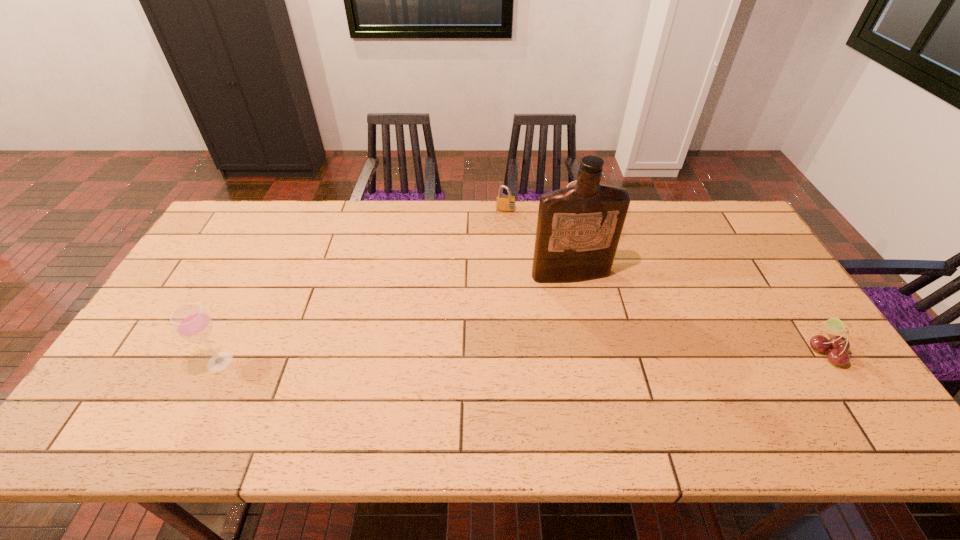
Find the location of a particular element. Image resolution: width=960 pixels, height=540 pixels. vacant space located on the leaves of the cherry is located at coordinates (735, 351).

This screenshot has width=960, height=540. I want to click on vacant space situated 0.390m on the side with the combination dials of the padlock, so click(x=501, y=297).

Identify the location of vacant space located on the side with the combination dials of the padlock. Image resolution: width=960 pixels, height=540 pixels. (505, 226).

I want to click on vacant space located on the side with the combination dials of the padlock, so click(x=504, y=245).

Identify the location of vacant position located 0.110m on the label side of the liquor. This screenshot has height=540, width=960. (588, 311).

Identify the location of vacant space located 0.320m on the label side of the liquor. (612, 375).

Locate an element on the screen. Image resolution: width=960 pixels, height=540 pixels. free spot located on the label side of the liquor is located at coordinates (594, 328).

At what (x,y) coordinates should I click in order to perform the action: click on vacant space situated 0.310m on the side of the mug with the handle. Please return your answer as a coordinate pair (x, y). This screenshot has width=960, height=540. Looking at the image, I should click on (595, 299).

You are a GUI agent. You are given a task and a screenshot of the screen. Output one action in this format:
    pyautogui.click(x=<x>, y=<y>)
    Task: Click on the vacant area situated on the side of the mug with the handle
    This screenshot has width=960, height=540.
    Given the screenshot: What is the action you would take?
    pyautogui.click(x=590, y=270)

The width and height of the screenshot is (960, 540). Identify the location of vacant space located 0.130m on the side of the mug with the handle. (588, 257).